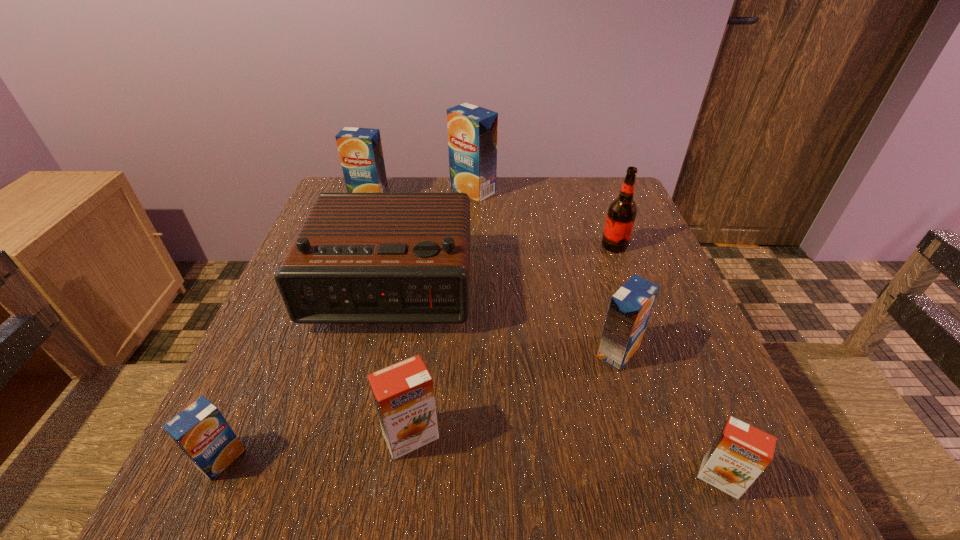
At what (x,y) coordinates should I click in order to perform the action: click on root beer at the right edge. Please return your answer as a coordinate pair (x, y). Image resolution: width=960 pixels, height=540 pixels. Looking at the image, I should click on (621, 215).

Locate an element on the screen. This screenshot has width=960, height=540. object that is positioned at the far left corner is located at coordinates tap(360, 149).

Image resolution: width=960 pixels, height=540 pixels. I want to click on object at the near left corner, so click(200, 430).

You are a GUI agent. You are given a task and a screenshot of the screen. Output one action in this format:
    pyautogui.click(x=<x>, y=<y>)
    Task: Click on the object at the near right corner
    The width and height of the screenshot is (960, 540).
    Given the screenshot: What is the action you would take?
    pyautogui.click(x=740, y=452)

Find the location of a particular element. The width and height of the screenshot is (960, 540). vacant space at the far edge of the desktop is located at coordinates (536, 212).

In the image, there is a desktop. Identify the location of vacant space at the near edge. The width and height of the screenshot is (960, 540). (629, 469).

This screenshot has width=960, height=540. Find the location of `vacant space at the left edge of the desktop`. vacant space at the left edge of the desktop is located at coordinates (286, 374).

Locate an element on the screen. The image size is (960, 540). free point at the right edge is located at coordinates (706, 372).

This screenshot has height=540, width=960. What are the coordinates of `vacant space at the near left corner` in the screenshot? It's located at (273, 510).

Find the location of a particular element. This screenshot has width=960, height=540. vacant space at the far right corner of the desktop is located at coordinates (599, 218).